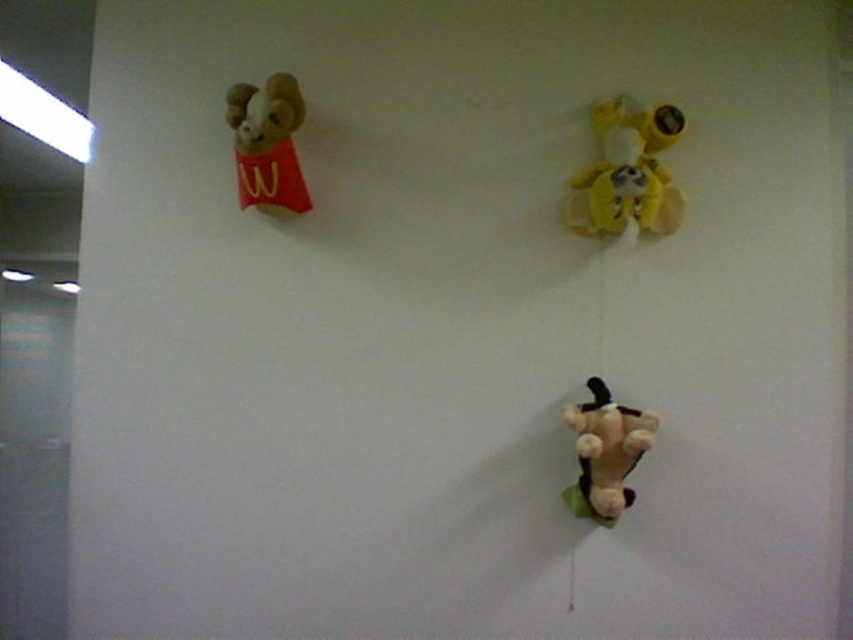
Image resolution: width=853 pixels, height=640 pixels. What do you see at coordinates (627, 173) in the screenshot?
I see `yellow plush toy at upper right` at bounding box center [627, 173].

Does point (602, 198) come in front of point (614, 520)?

No.

Identify the location of yellow plush toy at upper right. The width and height of the screenshot is (853, 640). (627, 173).

Does velvet plush ram at upper left have a larger size compared to soft brown plush toy at bottom right?

Yes, velvet plush ram at upper left is bigger than soft brown plush toy at bottom right.

Measure the distance from velvet plush ram at upper left to soft brown plush toy at bottom right.

A distance of 68.13 centimeters exists between velvet plush ram at upper left and soft brown plush toy at bottom right.

Between point (235, 168) and point (584, 445), which one is positioned in front?

Point (584, 445) is in front.

Image resolution: width=853 pixels, height=640 pixels. Find the location of `velvet plush ram at upper left`. velvet plush ram at upper left is located at coordinates (267, 141).

Can you confirm if yellow plush toy at upper right is positioned to the left of velvet plush ram at upper left?

No, yellow plush toy at upper right is not to the left of velvet plush ram at upper left.

Is point (598, 164) farther from camera compared to point (283, 138)?

That is True.

The image size is (853, 640). What do you see at coordinates (627, 173) in the screenshot? I see `yellow plush toy at upper right` at bounding box center [627, 173].

Where is `yellow plush toy at upper right`? The image size is (853, 640). yellow plush toy at upper right is located at coordinates (627, 173).